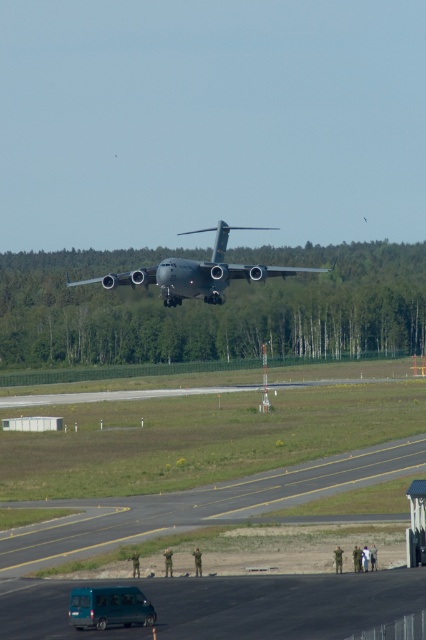
In the scene shown: Is asphalt runway at lower center shorter than teal matte van at lower left?

Correct, asphalt runway at lower center is not as tall as teal matte van at lower left.

Between asphalt runway at lower center and teal matte van at lower left, which one has less height?

With less height is asphalt runway at lower center.

You are a GUI agent. You are given a task and a screenshot of the screen. Output one action in this format:
    pyautogui.click(x=<x>, y=<y>)
    Task: Click on the asphalt runway at lower center
    This screenshot has height=640, width=426.
    Given the screenshot: What is the action you would take?
    pyautogui.click(x=199, y=504)

Between metallic gray aircraft at center and teal matte van at lower left, which one is positioned lower?

Positioned lower is teal matte van at lower left.

Is point (216, 248) closer to viewer compared to point (97, 611)?

That is False.

I want to click on metallic gray aircraft at center, so (198, 273).

Can you confirm if asphalt runway at lower center is wider than metallic gray aircraft at center?

No.

Measure the distance between point (258,499) and camera.

A: A distance of 36.27 meters exists between point (258,499) and camera.

Who is more distant from viewer, (215, 493) or (104, 280)?

Point (104, 280)

This screenshot has width=426, height=640. Identify the location of asphalt runway at lower center. (199, 504).